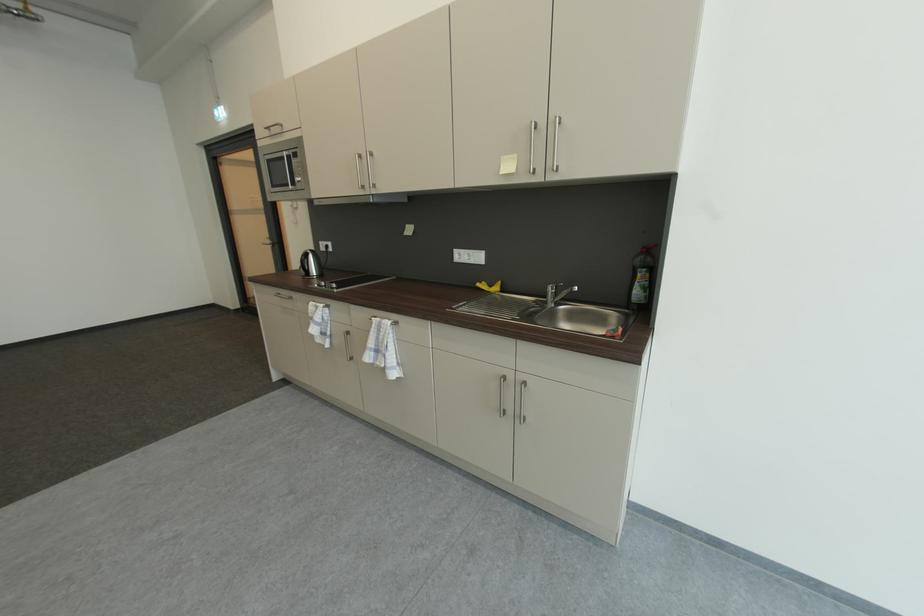
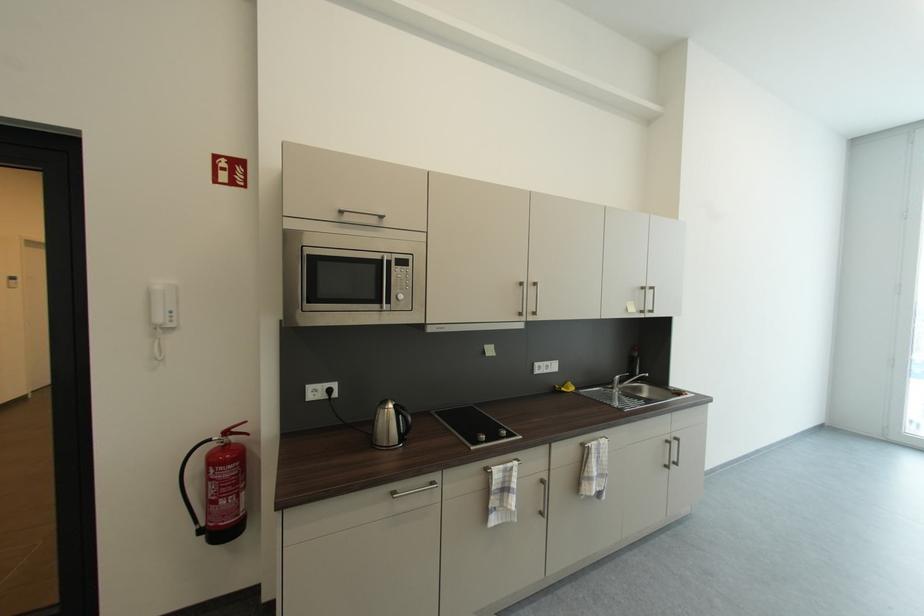
Find the pixel in the second image that matches point (299, 155) in the first image.

(403, 261)